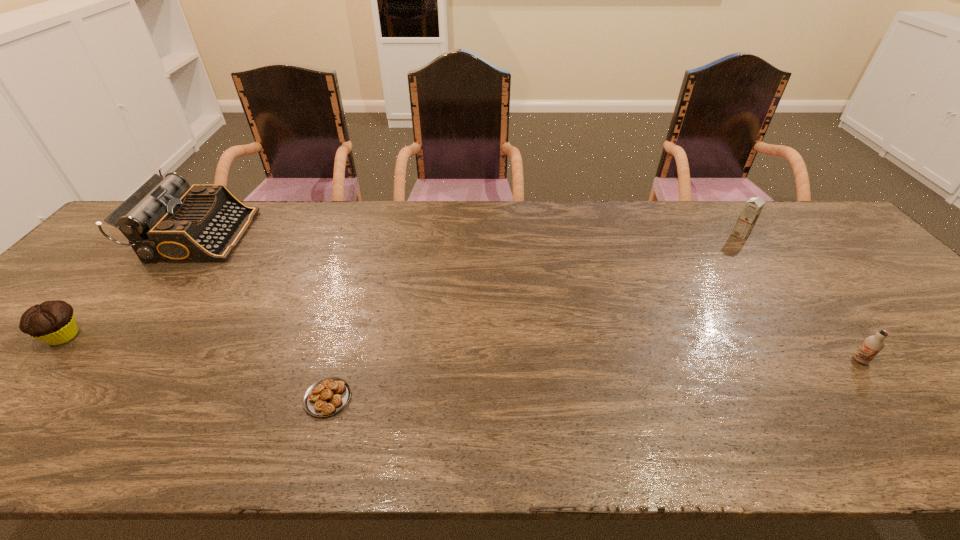
Identify the location of free space that is in between the fourth farthest object and the third farthest object. (462, 348).

The image size is (960, 540). Find the location of `free space between the typewriter and the third object from left to right`. free space between the typewriter and the third object from left to right is located at coordinates (264, 316).

At what (x,y) coordinates should I click in order to perform the action: click on vacant area that lies between the left chocolate milk and the second nearest object. Please return your answer as a coordinate pair (x, y). Image resolution: width=960 pixels, height=540 pixels. Looking at the image, I should click on (801, 297).

At what (x,y) coordinates should I click in order to perform the action: click on free point between the shortest object and the typewriter. Please return your answer as a coordinate pair (x, y). This screenshot has height=540, width=960. Looking at the image, I should click on (264, 316).

Identify the location of free space between the shorter chocolate milk and the third farthest object. Image resolution: width=960 pixels, height=540 pixels. (462, 348).

Identify which object is the nearest to the muffin. Please provide its 2D coordinates. Your answer should be formatted as a tuple, i.e. [(x, y)], where the tuple contains the x and y coordinates of a point satisfying the conditions above.

[(165, 220)]

Identify the location of object that is the third closest one to the shortest object. This screenshot has width=960, height=540. (872, 345).

In order to click on free spot that satisfies the following two spatial constraints: 1. on the front side of the third farthest object; 2. on the left side of the second nearest object in this screenshot , I will do `click(41, 360)`.

Where is `vacant space that satisfies the following two spatial constraints: 1. on the keyboard of the rightmost object; 2. on the right side of the tallest object`? The image size is (960, 540). vacant space that satisfies the following two spatial constraints: 1. on the keyboard of the rightmost object; 2. on the right side of the tallest object is located at coordinates tap(101, 360).

Find the location of a particular element. free space that satisfies the following two spatial constraints: 1. on the front side of the third farthest object; 2. on the left side of the rightmost object is located at coordinates (41, 360).